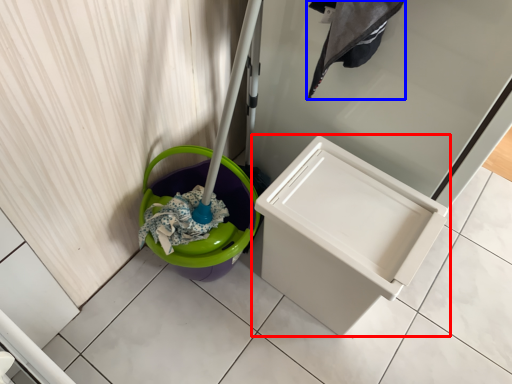
Question: Which object appears closest to the camera in this image, waste container (highlighted by a red box) or laundry (highlighted by a blue box)?

Choices:
 (A) waste container
 (B) laundry

Answer: (B)